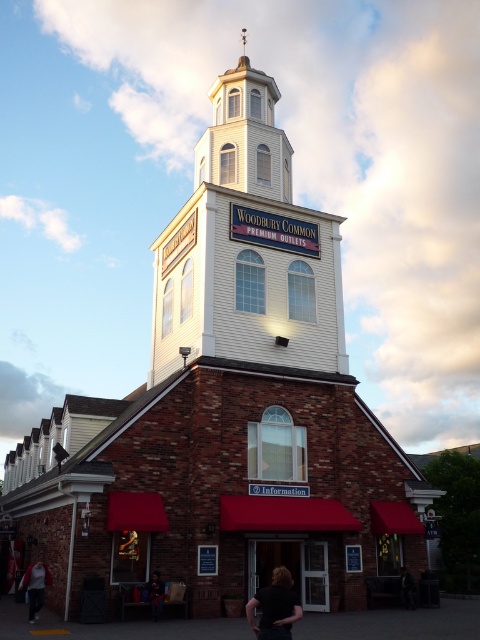
You are standing at the entrance of the Woodbury Common Premium Outlets and see a person with dark hair at lower center and a dark brown leather jacket at lower center. You need to place a bench between them. What is the minimum length the bench should be to ensure both can sit comfortably?

The dark hair at lower center is 15.65 meters from dark brown leather jacket at lower center. To place a bench between them, the minimum length should be at least 15.65 meters to accommodate the distance between them.

In the scene shown: You are standing in front of the building and want to take a photo of the dark hair at lower center and the dark brown leather jacket at lower center. Which object should you focus on first if you want to ensure both are in the frame?

You should focus on the dark hair at lower center first because it is larger in size compared to the dark brown leather jacket at lower center, ensuring both fit within the frame.